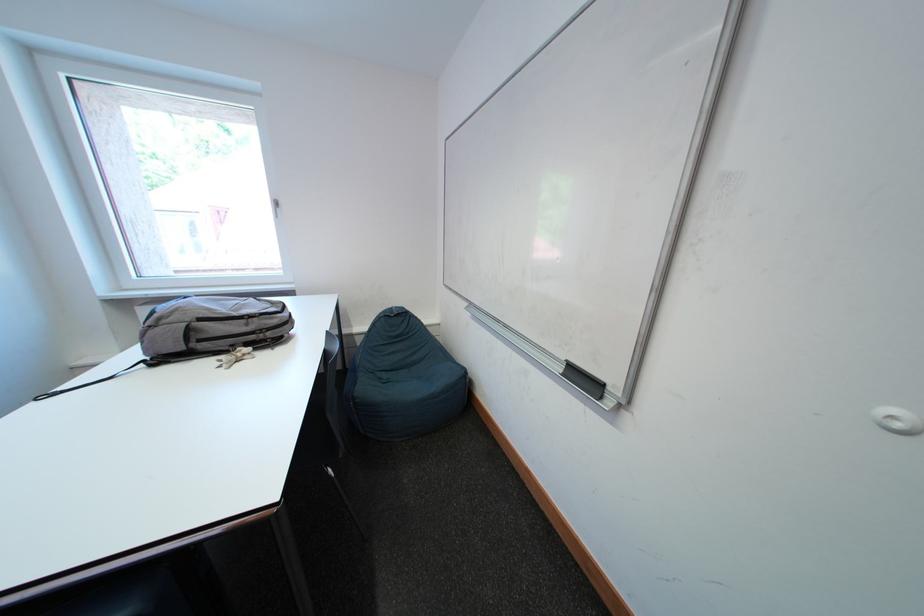
What do you see at coordinates (419, 376) in the screenshot?
I see `a chair sitting surface` at bounding box center [419, 376].